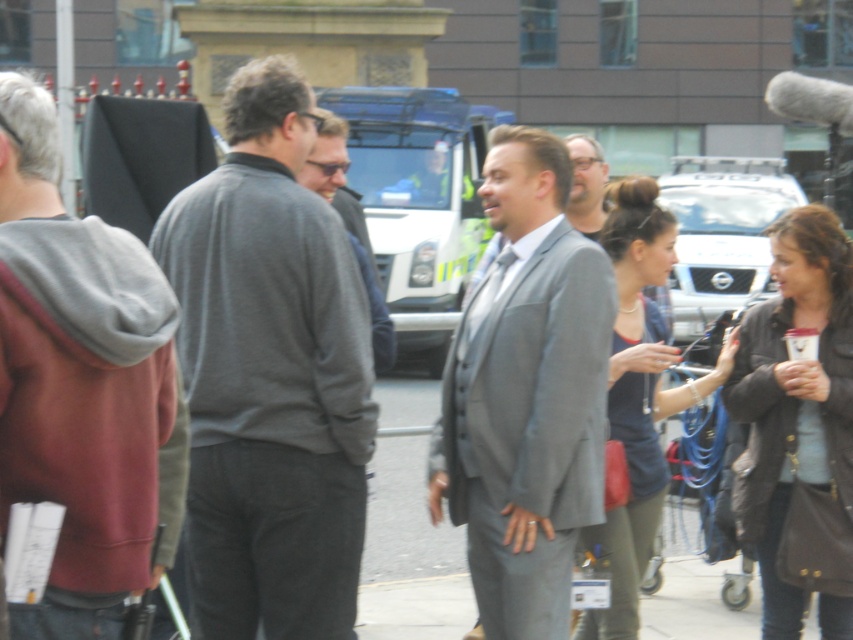
Does matte gray suit at center have a greater width compared to matte blue top at center?

Incorrect, matte gray suit at center's width does not surpass matte blue top at center's.

In order to click on matte gray suit at center in this screenshot , I will do `click(526, 394)`.

Where is `matte gray suit at center`? The height and width of the screenshot is (640, 853). matte gray suit at center is located at coordinates (526, 394).

Is point (289, 168) positioned before point (820, 214)?

Yes, it is in front of point (820, 214).

Does point (242, 547) lie in front of point (755, 394)?

Yes, it is in front of point (755, 394).

Identify the location of dark gray sweater at center. (270, 376).

Which is more to the right, dark gray sweater at center or matte gray suit at center?

Positioned to the right is matte gray suit at center.

Is point (271, 346) positioned after point (503, 268)?

No, it is not.

Identify the location of dark gray sweater at center. (270, 376).